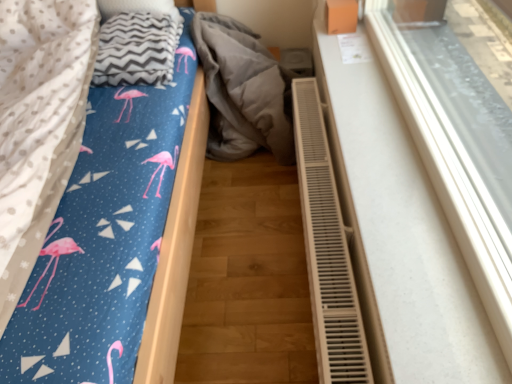
Question: Does white plastic radiator at right come behind gray fabric at center?

Choices:
 (A) no
 (B) yes

Answer: (A)

Question: Does white plastic radiator at right have a smaller size compared to gray fabric at center?

Choices:
 (A) yes
 (B) no

Answer: (A)

Question: Does white plastic radiator at right appear on the left side of gray fabric at center?

Choices:
 (A) yes
 (B) no

Answer: (B)

Question: From a real-world perspective, is white plastic radiator at right on top of gray fabric at center?

Choices:
 (A) yes
 (B) no

Answer: (A)

Question: Considering the relative sizes of white plastic radiator at right and gray fabric at center in the image provided, is white plastic radiator at right shorter than gray fabric at center?

Choices:
 (A) no
 (B) yes

Answer: (B)

Question: From the image's perspective, relative to white plastic radiator at right, is gray fabric at center above or below?

Choices:
 (A) below
 (B) above

Answer: (B)

Question: Is gray fabric at center bigger or smaller than white plastic radiator at right?

Choices:
 (A) small
 (B) big

Answer: (B)

Question: Is point (286, 135) positioned closer to the camera than point (438, 172)?

Choices:
 (A) farther
 (B) closer

Answer: (A)

Question: Considering the relative positions of gray fabric at center and white plastic radiator at right in the image provided, is gray fabric at center to the left or to the right of white plastic radiator at right?

Choices:
 (A) left
 (B) right

Answer: (A)

Question: Would you say gray fabric at center is to the left or to the right of white plastic radiator at lower right in the picture?

Choices:
 (A) left
 (B) right

Answer: (A)

Question: From the image's perspective, is gray fabric at center above or below white plastic radiator at lower right?

Choices:
 (A) below
 (B) above

Answer: (B)

Question: From a real-world perspective, is gray fabric at center above or below white plastic radiator at lower right?

Choices:
 (A) above
 (B) below

Answer: (A)

Question: Considering the positions of gray fabric at center and white plastic radiator at lower right in the image, is gray fabric at center taller or shorter than white plastic radiator at lower right?

Choices:
 (A) short
 (B) tall

Answer: (B)

Question: Is blue fabric bed at center inside or outside of flamingo-patterned fabric at left?

Choices:
 (A) inside
 (B) outside

Answer: (B)

Question: From the image's perspective, is blue fabric bed at center positioned above or below flamingo-patterned fabric at left?

Choices:
 (A) above
 (B) below

Answer: (B)